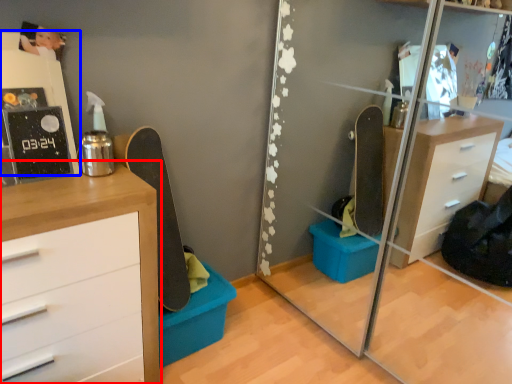
Question: Among these objects, which one is nearest to the camera, chest of drawers (highlighted by a red box) or shelf (highlighted by a blue box)?

Choices:
 (A) chest of drawers
 (B) shelf

Answer: (A)